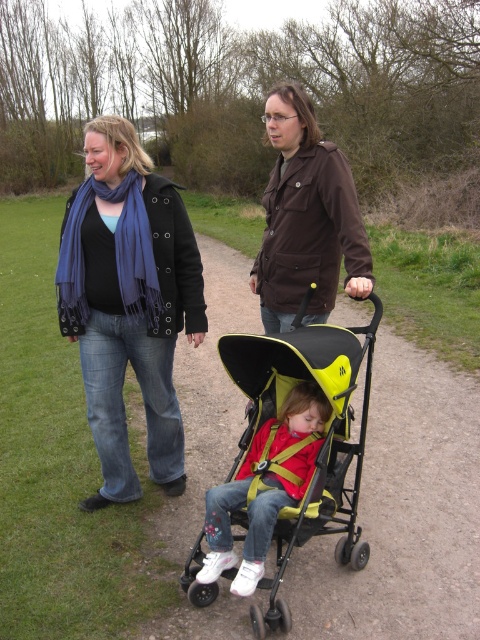
Question: Which is farther from the yellow matte baby carriage at center?

Choices:
 (A) matte yellow stroller at center
 (B) brown matte jacket at upper center

Answer: (B)

Question: Is yellow matte baby carriage at center positioned in front of matte yellow stroller at center?

Choices:
 (A) yes
 (B) no

Answer: (A)

Question: Where is yellow matte baby carriage at center located in relation to matte yellow stroller at center in the image?

Choices:
 (A) left
 (B) right

Answer: (B)

Question: Which point is farther to the camera?

Choices:
 (A) yellow matte baby carriage at center
 (B) brown matte jacket at upper center

Answer: (B)

Question: Which object is the farthest from the matte black coat at center?

Choices:
 (A) yellow matte baby carriage at center
 (B) brown matte jacket at upper center
 (C) matte yellow stroller at center

Answer: (B)

Question: Is matte black coat at center positioned in front of yellow matte baby carriage at center?

Choices:
 (A) yes
 (B) no

Answer: (B)